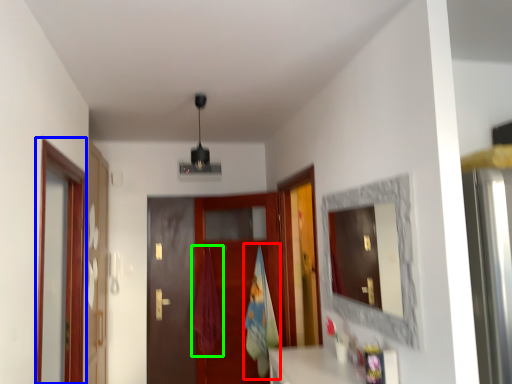
Question: Which is nearer to the beach towel (highlighted by a red box)? screen door (highlighted by a blue box) or curtain (highlighted by a green box).

Choices:
 (A) screen door
 (B) curtain

Answer: (B)